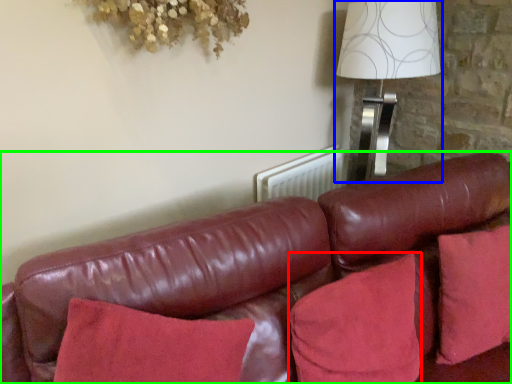
Question: Which is nearer to the pillow (highlighted by a red box)? table lamp (highlighted by a blue box) or studio couch (highlighted by a green box).

Choices:
 (A) table lamp
 (B) studio couch

Answer: (B)